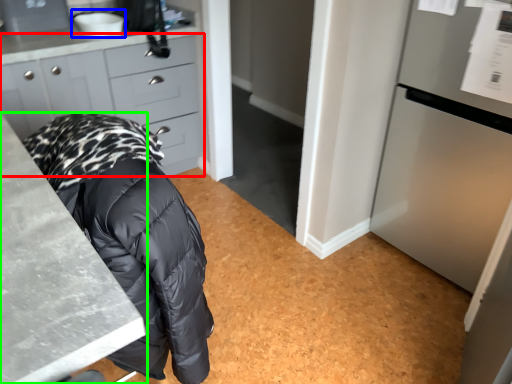
Question: Which object is positioned closest to cabinetry (highlighted by a red box)? Select from sink (highlighted by a blue box) and countertop (highlighted by a green box).

Choices:
 (A) sink
 (B) countertop

Answer: (A)